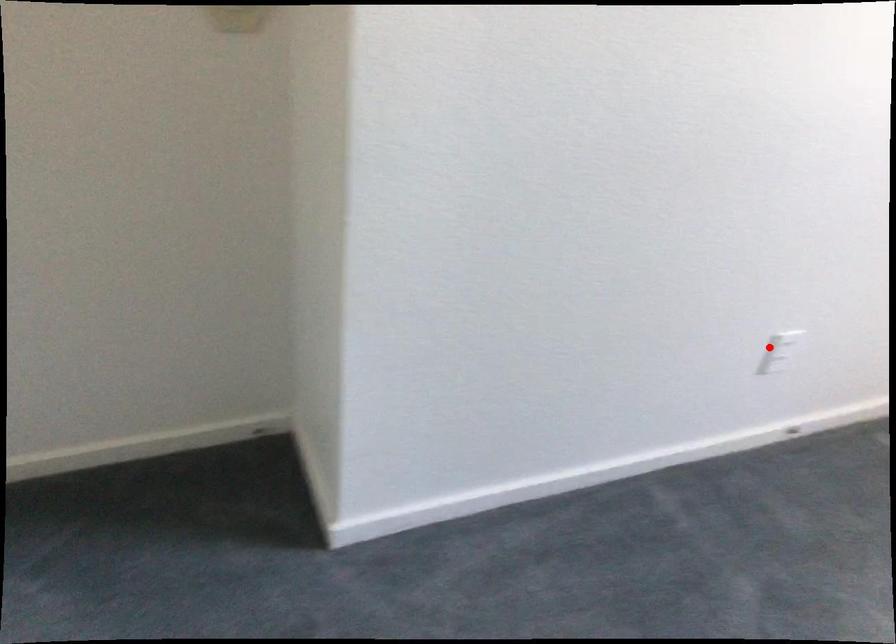
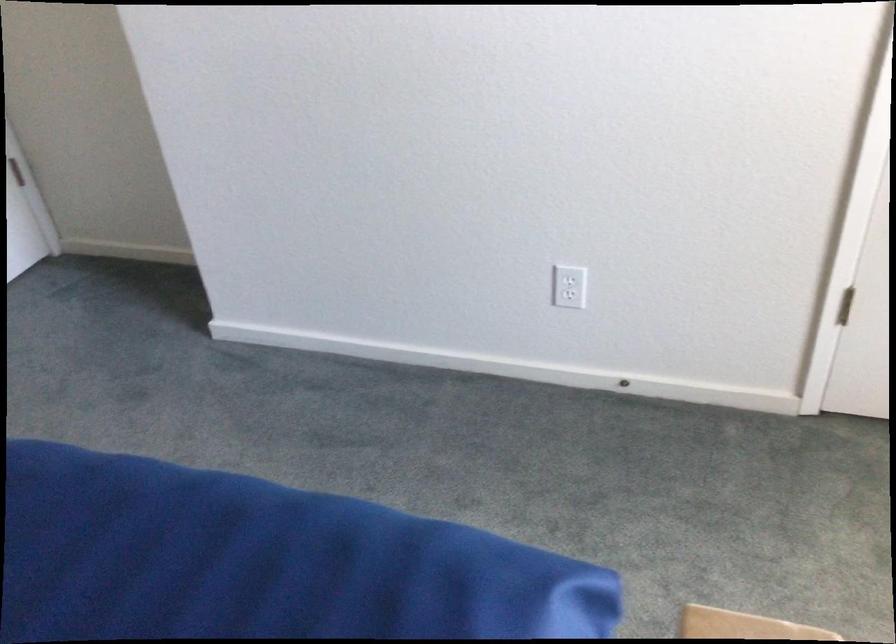
The point at the highlighted location is marked in the first image. Where is the corresponding point in the second image?

(570, 279)